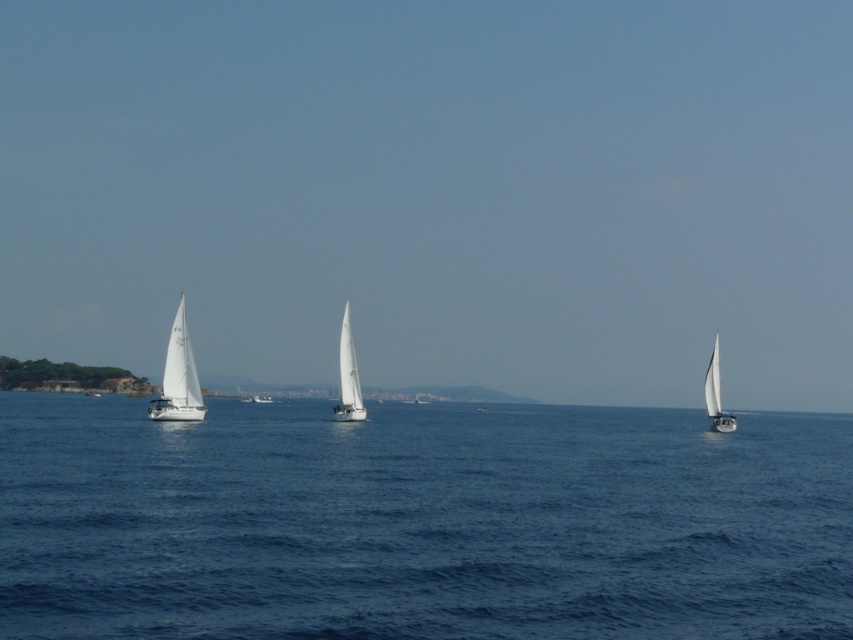
You are a photographer trying to capture the white matte sailboat at left and the white matte sailboat at center in a single frame. Based on their positions and sizes, which boat should you focus on to ensure both are clearly visible in your shot?

The white matte sailboat at left might be wider than white matte sailboat at center, so focusing on the wider boat at left would help ensure both are clearly visible in the frame.

You are a photographer positioned at the shore, aiming to capture a photo of the white matte sailboat at left and the white matte sailboat at center. Which sailboat should you adjust your camera focus to first if you want to focus on the one closer to the shore?

The white matte sailboat at left is to the left of the white matte sailboat at center, so the white matte sailboat at left is closer to the shore. Therefore, you should adjust your camera focus to the white matte sailboat at left first.

In the scene shown: You are a photographer trying to capture the white matte sailboat at left and the white matte sailboat at right in a single frame. Based on their heights, which one would appear smaller in the photo?

The white matte sailboat at left would appear smaller in the photo because it has a lesser height compared to the white matte sailboat at right.